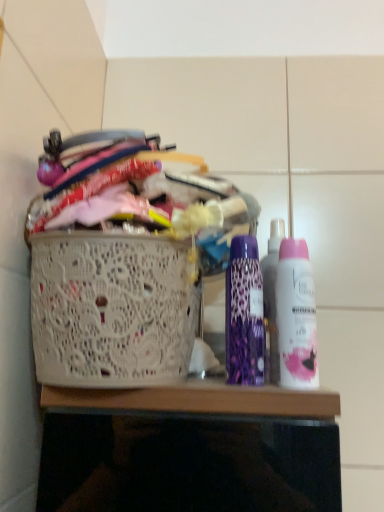
Question: Considering the relative positions of white lace basket at left and purple leopard print deodorant at center, the second bottle in the right-to-left sequence, in the image provided, is white lace basket at left to the left of purple leopard print deodorant at center, the second bottle in the right-to-left sequence, from the viewer's perspective?

Choices:
 (A) yes
 (B) no

Answer: (A)

Question: Is white lace basket at left in front of purple leopard print deodorant at center, the second bottle in the right-to-left sequence?

Choices:
 (A) yes
 (B) no

Answer: (A)

Question: Is white lace basket at left at the right side of purple leopard print deodorant at center, the second bottle in the right-to-left sequence?

Choices:
 (A) yes
 (B) no

Answer: (B)

Question: Is white lace basket at left beside purple leopard print deodorant at center, the second bottle in the right-to-left sequence?

Choices:
 (A) yes
 (B) no

Answer: (B)

Question: Could you tell me if white lace basket at left is facing purple leopard print deodorant at center, positioned as the 1th bottle in left-to-right order?

Choices:
 (A) no
 (B) yes

Answer: (A)

Question: Is white lace basket at left taller than purple leopard print deodorant at center, the second bottle in the right-to-left sequence?

Choices:
 (A) no
 (B) yes

Answer: (B)

Question: Is purple leopard print deodorant at center, positioned as the 1th bottle in left-to-right order, further to camera compared to white lace basket at left?

Choices:
 (A) no
 (B) yes

Answer: (B)

Question: Is purple leopard print deodorant at center, the second bottle in the right-to-left sequence, looking in the opposite direction of white lace basket at left?

Choices:
 (A) yes
 (B) no

Answer: (B)

Question: Is purple leopard print deodorant at center, positioned as the 1th bottle in left-to-right order, not inside white lace basket at left?

Choices:
 (A) no
 (B) yes

Answer: (B)

Question: Can you see purple leopard print deodorant at center, the second bottle in the right-to-left sequence, touching white lace basket at left?

Choices:
 (A) yes
 (B) no

Answer: (B)

Question: Is white lace basket at left completely or partially inside purple leopard print deodorant at center, the second bottle in the right-to-left sequence?

Choices:
 (A) no
 (B) yes

Answer: (A)

Question: Considering the relative sizes of purple leopard print deodorant at center, positioned as the 1th bottle in left-to-right order, and white lace basket at left in the image provided, is purple leopard print deodorant at center, positioned as the 1th bottle in left-to-right order, shorter than white lace basket at left?

Choices:
 (A) no
 (B) yes

Answer: (B)

Question: Is pink matte deodorant at right, which appears as the first bottle when viewed from the right, bigger than white lace basket at left?

Choices:
 (A) yes
 (B) no

Answer: (B)